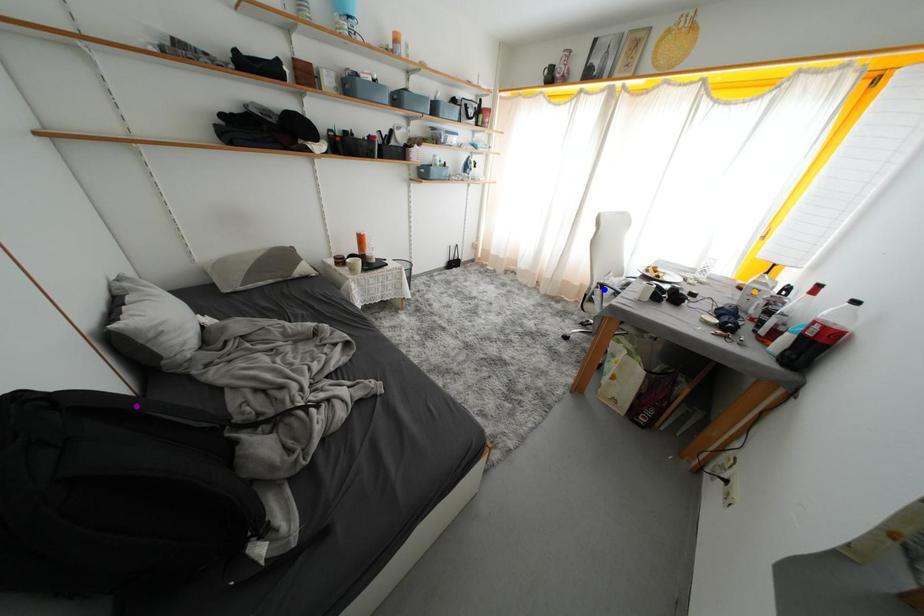
Order these from nearest to farthest:
orange point
blue point
purple point

purple point < orange point < blue point